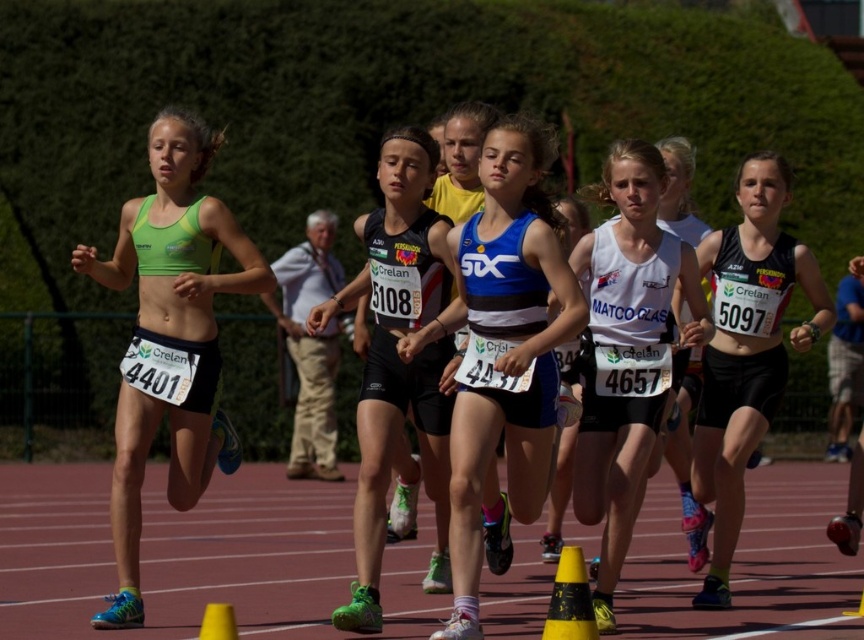
Can you confirm if black matte tank top at center is thinner than yellow plastic cone at lower right?

In fact, black matte tank top at center might be wider than yellow plastic cone at lower right.

Can you confirm if black matte tank top at center is smaller than yellow plastic cone at lower right?

Incorrect, black matte tank top at center is not smaller in size than yellow plastic cone at lower right.

This screenshot has height=640, width=864. Describe the element at coordinates (746, 349) in the screenshot. I see `black matte tank top at center` at that location.

Find the location of a particular element. Image resolution: width=864 pixels, height=640 pixels. black matte tank top at center is located at coordinates (746, 349).

Can you confirm if yellow plastic cone at lower right is bigger than yellow plastic cone at lower center?

Indeed, yellow plastic cone at lower right has a larger size compared to yellow plastic cone at lower center.

Find the location of a particular element. This screenshot has height=640, width=864. yellow plastic cone at lower right is located at coordinates (570, 600).

Does black matte tank top at center lie behind yellow plastic cone at lower center?

Yes, black matte tank top at center is further from the viewer.

Does black matte tank top at center have a larger size compared to yellow plastic cone at lower center?

Correct, black matte tank top at center is larger in size than yellow plastic cone at lower center.

Is point (801, 243) in front of point (233, 612)?

No.

Locate an element on the screen. The width and height of the screenshot is (864, 640). black matte tank top at center is located at coordinates (746, 349).